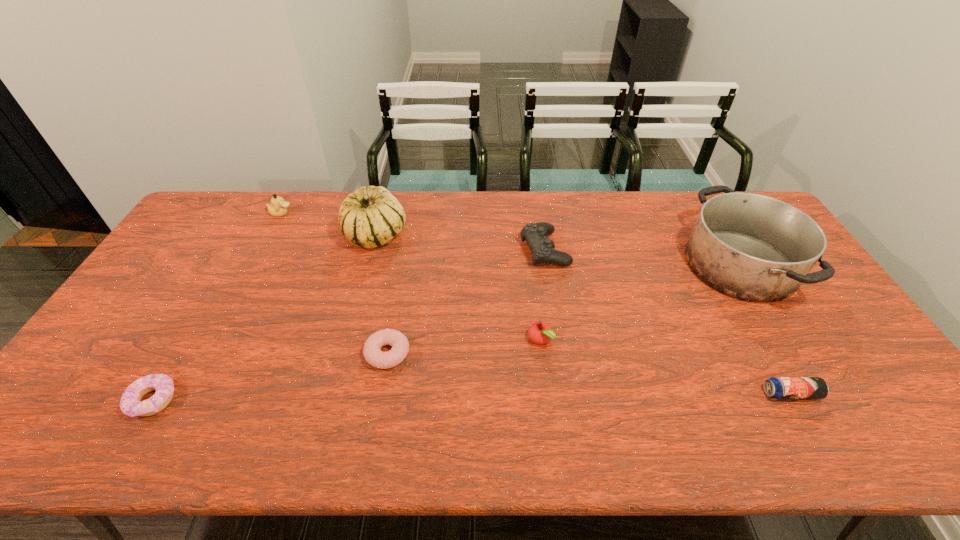
Find the location of a particular element. object present at the near edge is located at coordinates (130, 404).

At what (x,y) coordinates should I click in order to perform the action: click on object that is at the right edge. Please return your answer as a coordinate pair (x, y). The height and width of the screenshot is (540, 960). Looking at the image, I should click on (751, 247).

Locate an element on the screen. object that is at the far right corner is located at coordinates point(751,247).

You are a GUI agent. You are given a task and a screenshot of the screen. Output one action in this format:
    pyautogui.click(x=<x>, y=<y>)
    Task: Click on the vacant space at the far edge of the desktop
    The width and height of the screenshot is (960, 540).
    Given the screenshot: What is the action you would take?
    pyautogui.click(x=612, y=220)

Identify the location of vacant space at the near edge. (254, 421).

Where is `vacant region at the right edge of the desktop`? The image size is (960, 540). vacant region at the right edge of the desktop is located at coordinates (887, 414).

You are a GUI agent. You are given a task and a screenshot of the screen. Output one action in this format:
    pyautogui.click(x=<x>, y=<y>)
    Task: Click on the vacant space at the far left corner of the desktop
    Image resolution: width=960 pixels, height=540 pixels.
    Given the screenshot: What is the action you would take?
    pyautogui.click(x=208, y=208)

I want to click on empty location between the beer can and the nearer doughnut, so click(x=471, y=397).

Where is `free space between the control and the saucepan`? free space between the control and the saucepan is located at coordinates (642, 257).

At what (x,y) coordinates should I click in order to perform the action: click on vacant point located between the farther doughnut and the control. Please return your answer as a coordinate pair (x, y). Looking at the image, I should click on [x=466, y=301].